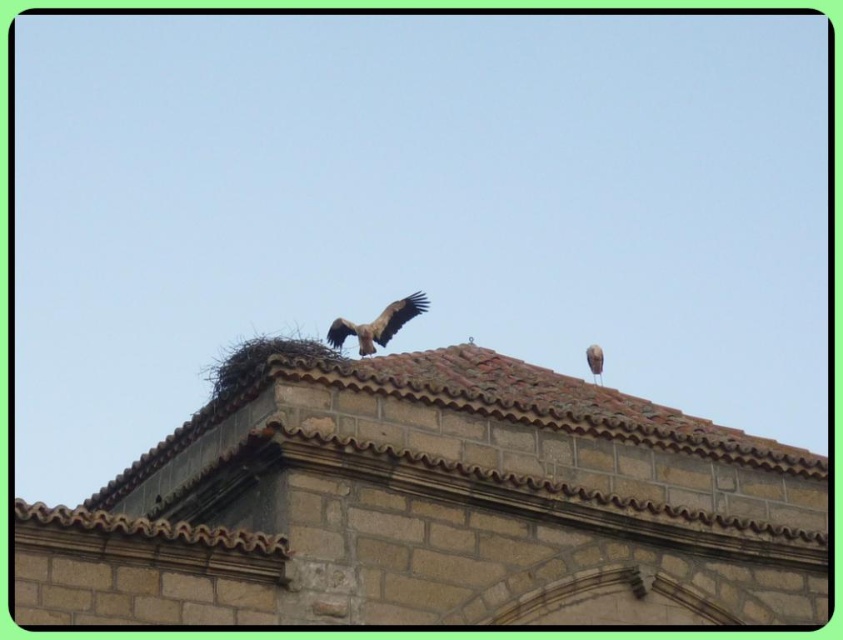
Question: Is brown tile roof at upper center positioned in front of brown feathered eagle at center?

Choices:
 (A) yes
 (B) no

Answer: (A)

Question: Which point is farther to the camera?

Choices:
 (A) (239, 451)
 (B) (347, 332)
 (C) (599, 349)

Answer: (B)

Question: Which of the following is the farthest from the observer?

Choices:
 (A) (366, 353)
 (B) (593, 371)
 (C) (471, 602)

Answer: (B)

Question: Is brown feathered eagle at center to the right of brown feathered bird at upper right from the viewer's perspective?

Choices:
 (A) no
 (B) yes

Answer: (A)

Question: Does brown feathered eagle at center appear on the right side of brown feathered bird at upper right?

Choices:
 (A) no
 (B) yes

Answer: (A)

Question: Estimate the real-world distances between objects in this image. Which object is farther from the brown feathered bird at upper right?

Choices:
 (A) brown tile roof at upper center
 (B) brown feathered eagle at center

Answer: (B)